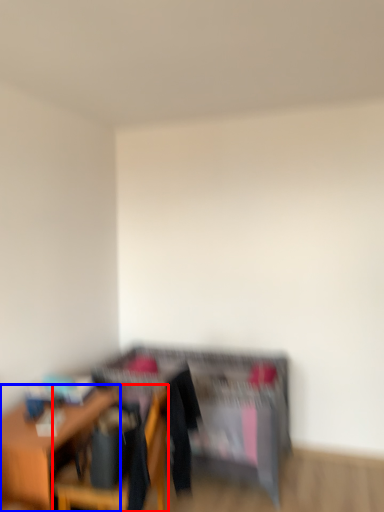
Question: Among these objects, which one is farthest to the camera, chair (highlighted by a red box) or table (highlighted by a blue box)?

Choices:
 (A) chair
 (B) table

Answer: (B)